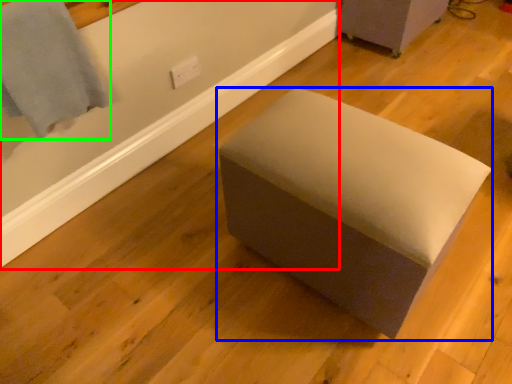
Question: Considering the real-world distances, which object is closest to bath (highlighted by a red box)? furniture (highlighted by a blue box) or bath towel (highlighted by a green box).

Choices:
 (A) furniture
 (B) bath towel

Answer: (B)